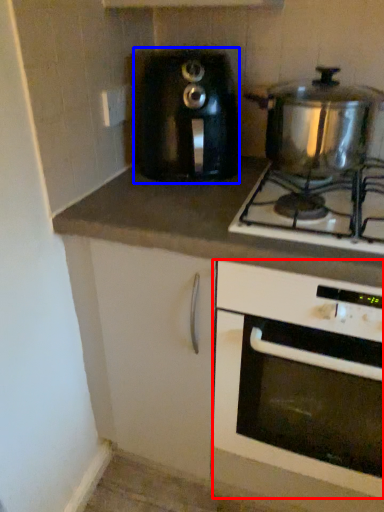
Question: Which point is closer to the camera, oven (highlighted by a red box) or toaster (highlighted by a blue box)?

Choices:
 (A) oven
 (B) toaster

Answer: (A)